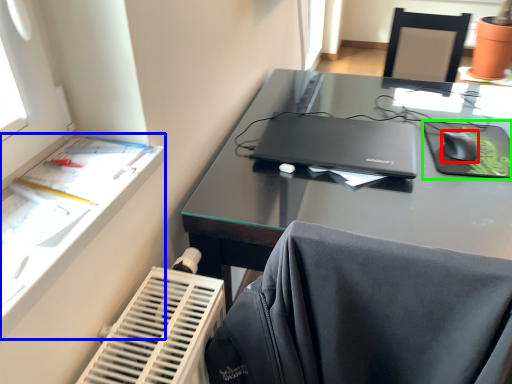
Question: Based on their relative distances, which object is farther from mouse (highlighted by a red box)? Choose from writing desk (highlighted by a blue box) and tablet computer (highlighted by a green box).

Choices:
 (A) writing desk
 (B) tablet computer

Answer: (A)